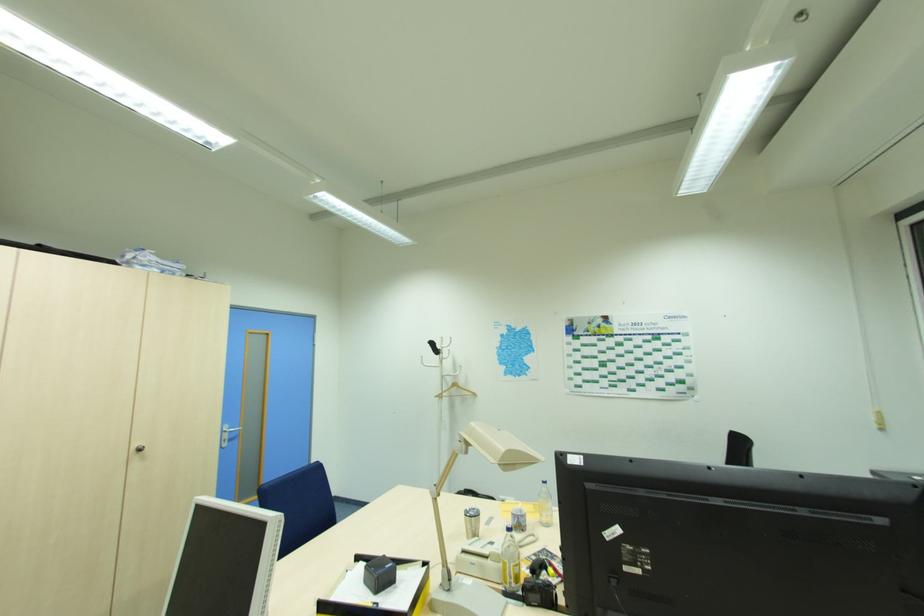
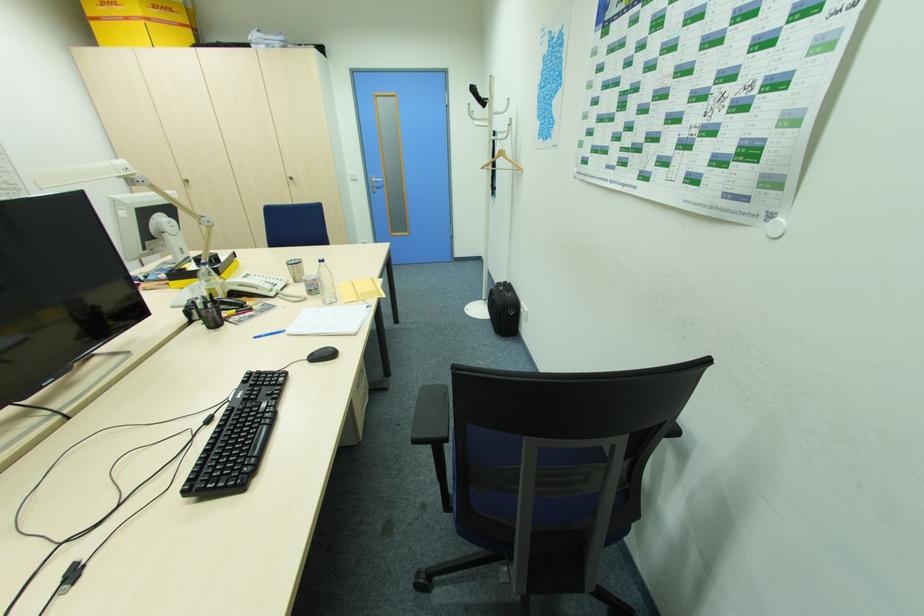
Locate, in the second image, the point that corresponds to pixel 439 397 in the first image.

(485, 168)